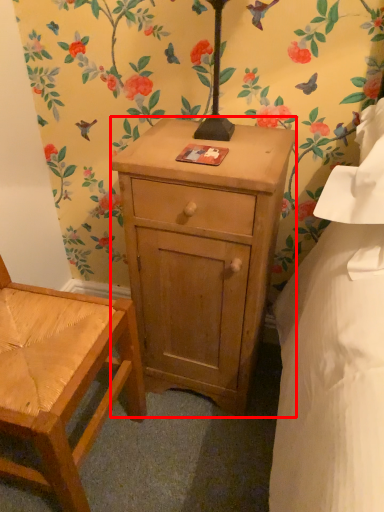
Question: From the image, what is the correct spatial relationship of nightstand (annotated by the red box) in relation to chair?

Choices:
 (A) left
 (B) right

Answer: (B)